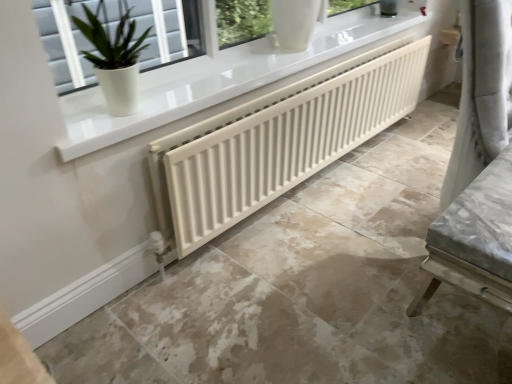
You are a GUI agent. You are given a task and a screenshot of the screen. Output one action in this format:
    pyautogui.click(x=<x>, y=<y>)
    Task: Click on the vacant location below white matte radiator at center (from a real-world perspective)
    
    Given the screenshot: What is the action you would take?
    pyautogui.click(x=366, y=149)